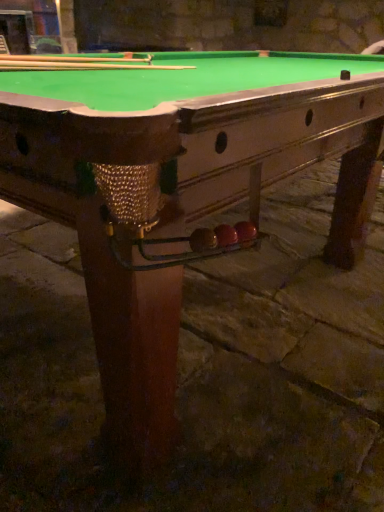
Question: In terms of height, does smooth wood cue at upper left, acting as the 1th cue starting from the back, look taller or shorter compared to wooden cue at upper center, the second cue when ordered from back to front?

Choices:
 (A) short
 (B) tall

Answer: (A)

Question: Visually, is smooth wood cue at upper left, which is counted as the 2th cue, starting from the front, positioned to the left or to the right of wooden cue at upper center, marked as the first cue in a front-to-back arrangement?

Choices:
 (A) left
 (B) right

Answer: (B)

Question: Choose the correct answer: Is smooth wood cue at upper left, which is counted as the 2th cue, starting from the front, inside wooden cue at upper center, the second cue when ordered from back to front, or outside it?

Choices:
 (A) inside
 (B) outside

Answer: (B)

Question: Does point (56, 61) appear closer or farther from the camera than point (13, 69)?

Choices:
 (A) farther
 (B) closer

Answer: (A)

Question: From a real-world perspective, is wooden cue at upper center, the second cue when ordered from back to front, positioned above or below smooth wood cue at upper left, which is counted as the 2th cue, starting from the front?

Choices:
 (A) below
 (B) above

Answer: (B)

Question: Is wooden cue at upper center, the second cue when ordered from back to front, to the left or to the right of smooth wood cue at upper left, which is counted as the 2th cue, starting from the front, in the image?

Choices:
 (A) left
 (B) right

Answer: (A)

Question: Is wooden cue at upper center, the second cue when ordered from back to front, wider or thinner than smooth wood cue at upper left, acting as the 1th cue starting from the back?

Choices:
 (A) thin
 (B) wide

Answer: (A)